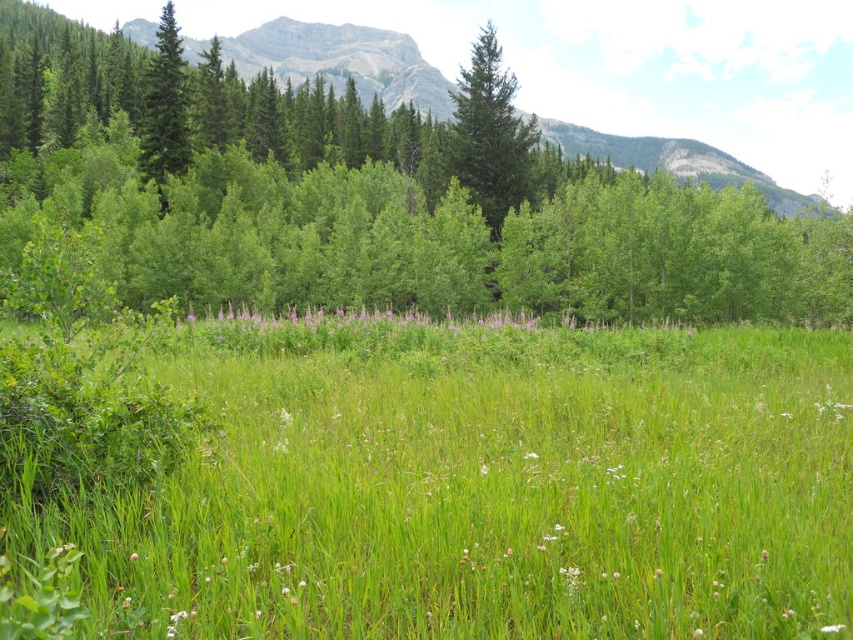
Can you confirm if green grassy pasture at center is bigger than white fluffy flower at center?

Correct, green grassy pasture at center is larger in size than white fluffy flower at center.

Can you confirm if green grassy pasture at center is taller than white fluffy flower at center?

Indeed, green grassy pasture at center has a greater height compared to white fluffy flower at center.

Where is `green grassy pasture at center`? This screenshot has width=853, height=640. green grassy pasture at center is located at coordinates (486, 490).

Is point (141, 257) in front of point (450, 317)?

Yes, it is.

Can you confirm if green leafy tree at center is taller than purple soft grass at center?

Correct, green leafy tree at center is much taller as purple soft grass at center.

Where is `green leafy tree at center`? green leafy tree at center is located at coordinates (378, 204).

Does green matte tree at center appear under purple soft grass at center?

Incorrect, green matte tree at center is not positioned below purple soft grass at center.

Does green matte tree at center have a lesser width compared to purple soft grass at center?

Correct, green matte tree at center's width is less than purple soft grass at center's.

Is point (460, 108) behind point (526, 324)?

Yes, it is.

The image size is (853, 640). Find the location of `green matte tree at center`. green matte tree at center is located at coordinates (490, 132).